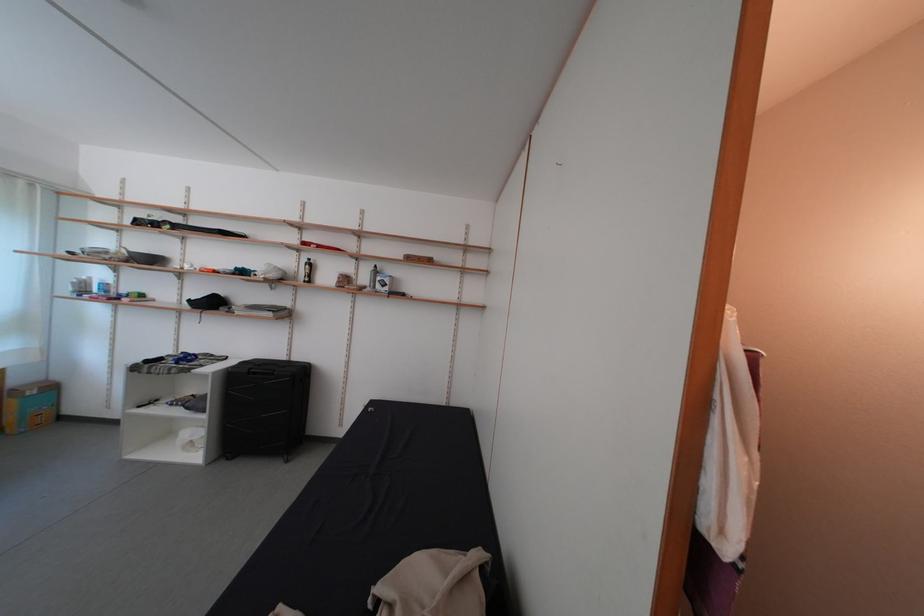
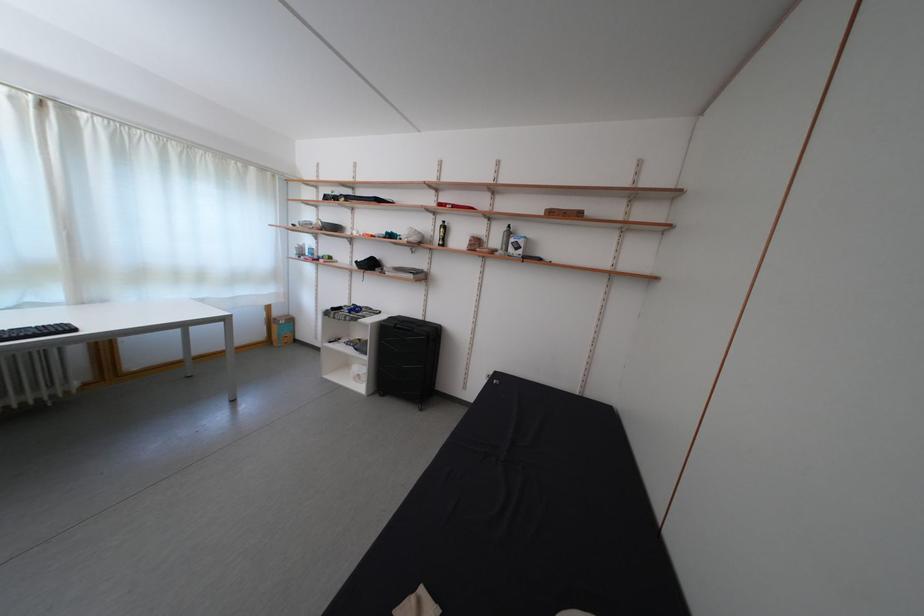
Find the pixel in the second image that matches point (372, 284) in the first image.

(505, 246)